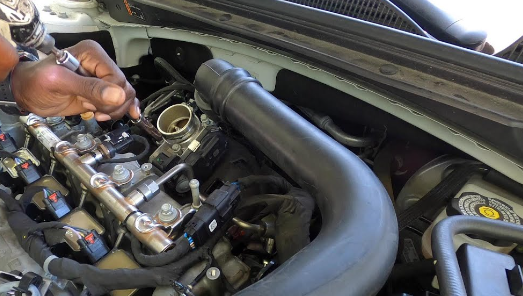
Where is `wires`? wires is located at coordinates (66, 224), (37, 189), (151, 255), (264, 177), (266, 196), (147, 141), (166, 89).